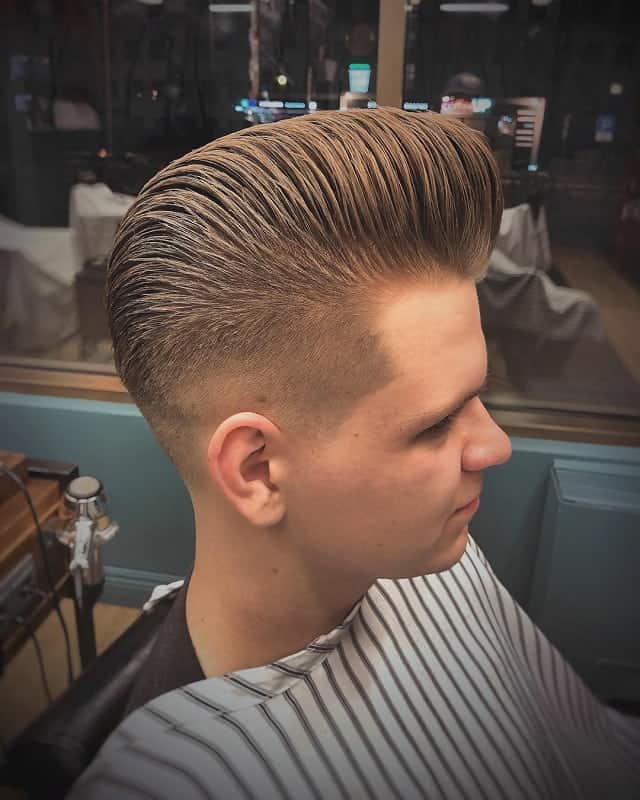
Locate an element on the screen. The width and height of the screenshot is (640, 800). blow dryer holder is located at coordinates (105, 540).